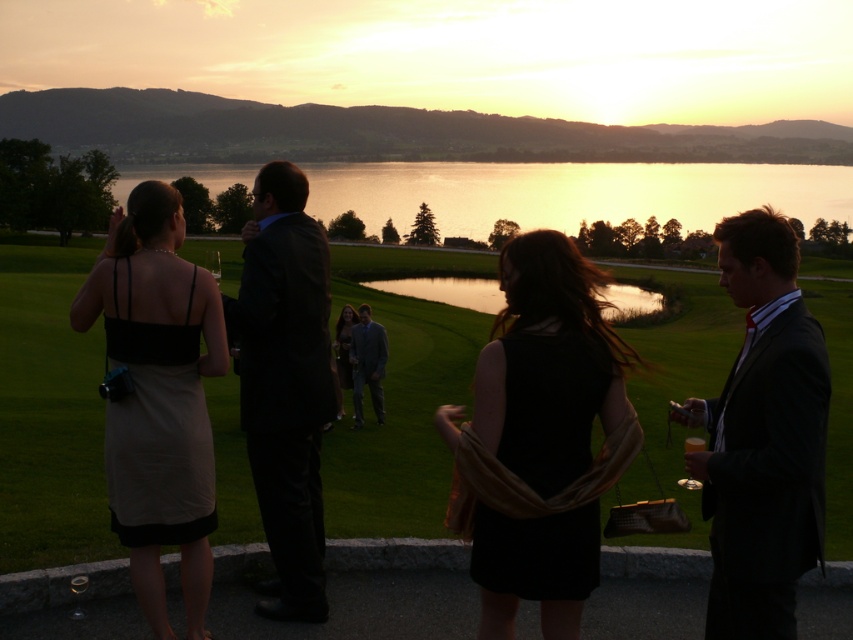
Is shiny black suit at center taller than matte gray suit at center?

Incorrect, shiny black suit at center's height is not larger of matte gray suit at center's.

Between shiny black suit at center and matte gray suit at center, which one has more height?

With more height is matte gray suit at center.

At what (x,y) coordinates should I click in order to perform the action: click on shiny black suit at center. Please return your answer as a coordinate pair (x, y). Image resolution: width=853 pixels, height=640 pixels. Looking at the image, I should click on (285, 384).

Who is positioned more to the right, black satin dress at center or matte black suit at right?

matte black suit at right

Which is below, black satin dress at center or matte black suit at right?

black satin dress at center is below.

Is point (560, 465) positioned before point (733, 436)?

Yes, it is.

You are a GUI agent. You are given a task and a screenshot of the screen. Output one action in this format:
    pyautogui.click(x=<x>, y=<y>)
    Task: Click on the black satin dress at center
    
    Given the screenshot: What is the action you would take?
    pyautogui.click(x=540, y=438)

Which is below, matte gray suit at center or matte black dress at center?

Positioned lower is matte gray suit at center.

This screenshot has width=853, height=640. Describe the element at coordinates (367, 364) in the screenshot. I see `matte gray suit at center` at that location.

Does point (364, 346) lie behind point (345, 332)?

No, (364, 346) is closer to viewer.

Where is `matte gray suit at center`? matte gray suit at center is located at coordinates tap(367, 364).